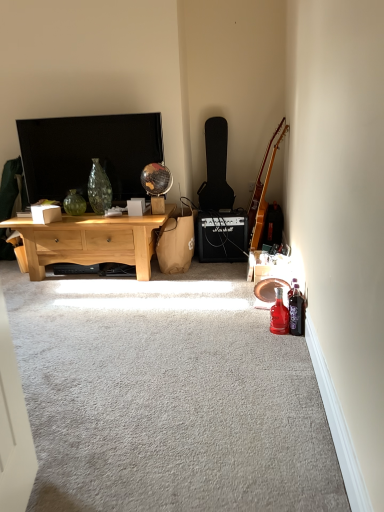
Image resolution: width=384 pixels, height=512 pixels. Identify the location of vacant area that lies between black matte amplifier at center and brown paper bag at center. (218, 264).